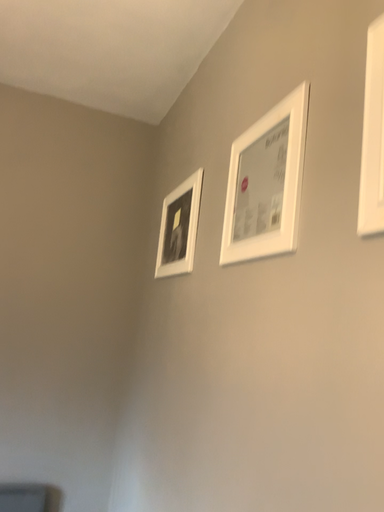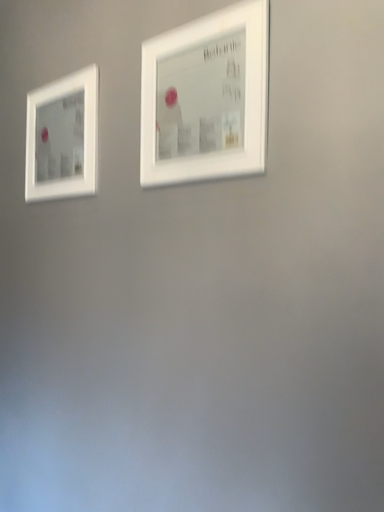
Question: Which way did the camera rotate in the video?

Choices:
 (A) rotated left
 (B) rotated right

Answer: (B)